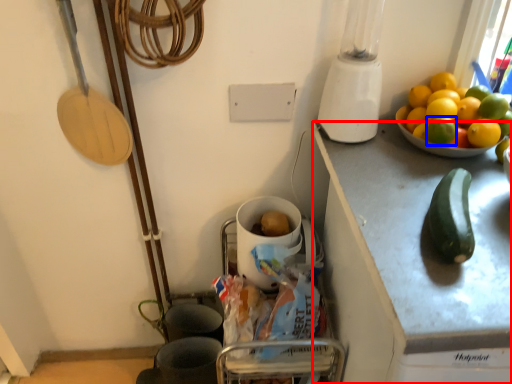
Question: Which point is further to the camera, cabinetry (highlighted by a red box) or lemon (highlighted by a blue box)?

Choices:
 (A) cabinetry
 (B) lemon

Answer: (B)